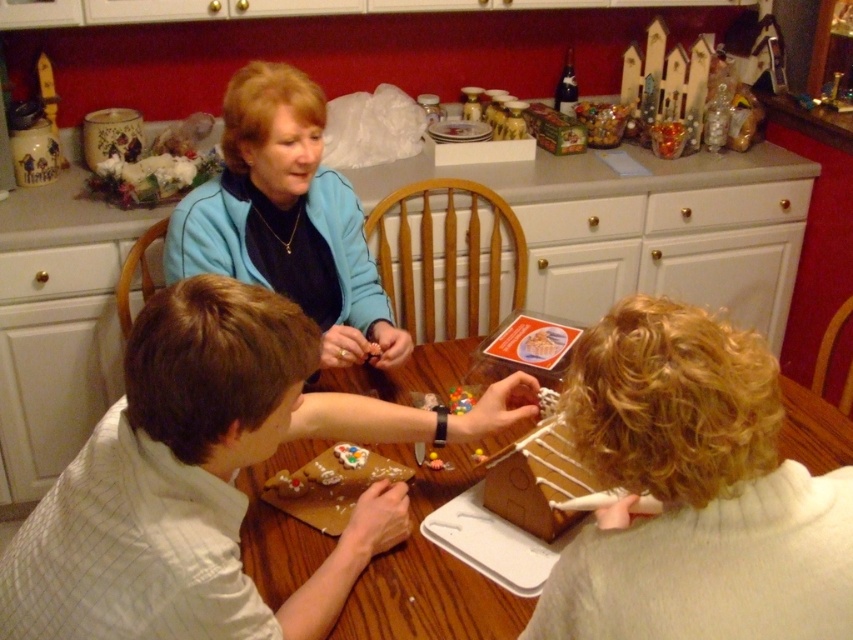
Is white striped shirt at center behind blue fleece jacket at upper center?

No, it is in front of blue fleece jacket at upper center.

Does point (53, 579) come in front of point (170, 244)?

Yes.

Is point (115, 417) positioned behind point (259, 188)?

That is False.

At what (x,y) coordinates should I click in order to perform the action: click on white striped shirt at center. Please return your answer as a coordinate pair (x, y). The height and width of the screenshot is (640, 853). Looking at the image, I should click on (207, 480).

Between white striped shirt at center and wooden table at center, which one appears on the left side from the viewer's perspective?

From the viewer's perspective, white striped shirt at center appears more on the left side.

Can you confirm if white striped shirt at center is taller than wooden table at center?

Indeed, white striped shirt at center has a greater height compared to wooden table at center.

Does point (219, 461) lie in front of point (349, 372)?

Yes, it is in front of point (349, 372).

You are a GUI agent. You are given a task and a screenshot of the screen. Output one action in this format:
    pyautogui.click(x=<x>, y=<y>)
    Task: Click on the white striped shirt at center
    
    Given the screenshot: What is the action you would take?
    pyautogui.click(x=207, y=480)

What do you see at coordinates (286, 218) in the screenshot?
I see `blue fleece jacket at upper center` at bounding box center [286, 218].

Who is positioned more to the left, blue fleece jacket at upper center or wooden table at center?

blue fleece jacket at upper center is more to the left.

Does point (257, 154) come in front of point (346, 390)?

Yes, it is.

This screenshot has height=640, width=853. In order to click on blue fleece jacket at upper center in this screenshot , I will do `click(286, 218)`.